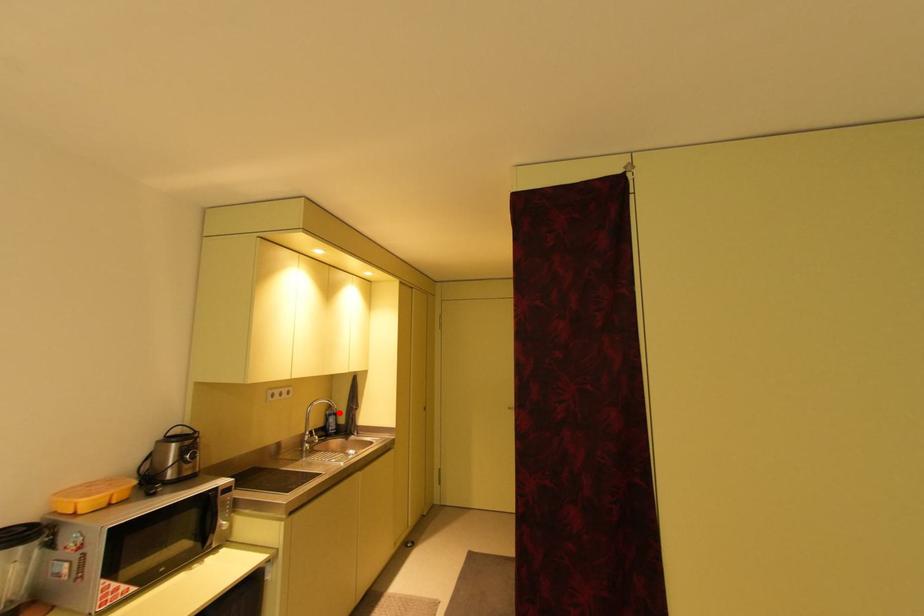
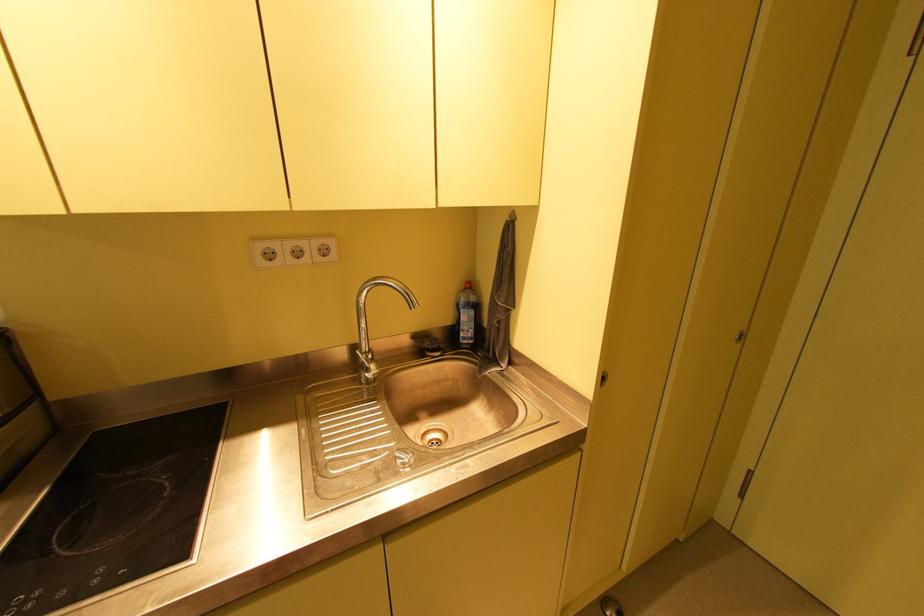
Where in the second image is the point corresponding to the highlighted location from the first image?

(479, 301)